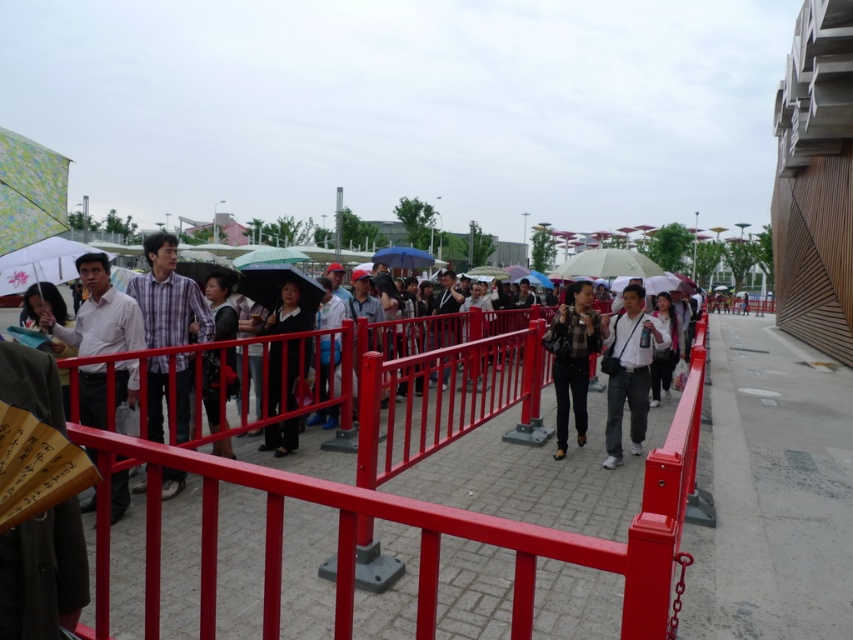
Which is behind, point (125, 378) or point (308, 344)?

Positioned behind is point (308, 344).

Between point (115, 342) and point (289, 387), which one is positioned in front?

Point (115, 342) is more forward.

Where is `matte white shirt at left`? This screenshot has width=853, height=640. matte white shirt at left is located at coordinates (100, 314).

Where is `matte white shirt at left`? Image resolution: width=853 pixels, height=640 pixels. matte white shirt at left is located at coordinates (100, 314).

Between matte white shirt at left and black fabric jacket at center, which one appears on the left side from the viewer's perspective?

From the viewer's perspective, matte white shirt at left appears more on the left side.

I want to click on matte white shirt at left, so click(x=100, y=314).

Identify the location of matte white shirt at left. Image resolution: width=853 pixels, height=640 pixels. (100, 314).

Consider the image. Between white matte shirt at center and plaid shirt at center, which one is positioned lower?

white matte shirt at center

Is white matte shirt at center in front of plaid shirt at center?

Yes.

Between point (614, 451) and point (572, 317), which one is positioned in front?

Positioned in front is point (614, 451).

Where is `white matte shirt at center`? white matte shirt at center is located at coordinates (630, 371).